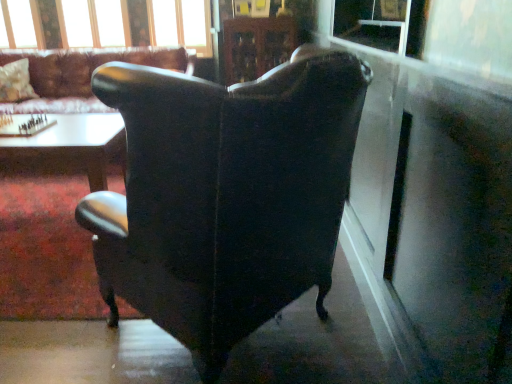
Question: Does clear glass window frame at upper center have a greater width compared to transparent plastic window screen at upper right?

Choices:
 (A) no
 (B) yes

Answer: (B)

Question: From a real-world perspective, is clear glass window frame at upper center on top of transparent plastic window screen at upper right?

Choices:
 (A) yes
 (B) no

Answer: (B)

Question: Considering the relative positions of clear glass window frame at upper center and transparent plastic window screen at upper right in the image provided, is clear glass window frame at upper center in front of transparent plastic window screen at upper right?

Choices:
 (A) yes
 (B) no

Answer: (B)

Question: Is clear glass window frame at upper center at the right side of transparent plastic window screen at upper right?

Choices:
 (A) no
 (B) yes

Answer: (A)

Question: Considering the relative sizes of clear glass window frame at upper center and transparent plastic window screen at upper right in the image provided, is clear glass window frame at upper center thinner than transparent plastic window screen at upper right?

Choices:
 (A) no
 (B) yes

Answer: (A)

Question: In the image, is white glossy table at lower left, placed as the second table when sorted from top to bottom, on the left side or the right side of wooden glossy table at center, which is the 1th table from top to bottom?

Choices:
 (A) left
 (B) right

Answer: (B)

Question: Is white glossy table at lower left, which is the 1th table from bottom to top, in front of or behind wooden glossy table at center, which is the second table from bottom to top, in the image?

Choices:
 (A) behind
 (B) front

Answer: (B)

Question: Considering the positions of white glossy table at lower left, which is the 1th table from bottom to top, and wooden glossy table at center, which is the second table from bottom to top, in the image, is white glossy table at lower left, which is the 1th table from bottom to top, bigger or smaller than wooden glossy table at center, which is the second table from bottom to top,?

Choices:
 (A) big
 (B) small

Answer: (B)

Question: Is white glossy table at lower left, which is the 1th table from bottom to top, taller or shorter than wooden glossy table at center, which is the 1th table from top to bottom?

Choices:
 (A) tall
 (B) short

Answer: (B)

Question: Is clear glass window frame at upper center situated inside white glossy table at lower left, placed as the second table when sorted from top to bottom, or outside?

Choices:
 (A) inside
 (B) outside

Answer: (B)

Question: Is point (200, 1) closer or farther from the camera than point (69, 274)?

Choices:
 (A) closer
 (B) farther

Answer: (B)

Question: Is clear glass window frame at upper center taller or shorter than white glossy table at lower left, which is the 1th table from bottom to top?

Choices:
 (A) tall
 (B) short

Answer: (A)

Question: Considering the positions of clear glass window frame at upper center and white glossy table at lower left, placed as the second table when sorted from top to bottom, in the image, is clear glass window frame at upper center wider or thinner than white glossy table at lower left, placed as the second table when sorted from top to bottom,?

Choices:
 (A) thin
 (B) wide

Answer: (A)

Question: Visually, is white glossy table at lower left, placed as the second table when sorted from top to bottom, positioned to the left or to the right of fluffy white pillow at upper left?

Choices:
 (A) left
 (B) right

Answer: (B)

Question: Considering the positions of white glossy table at lower left, which is the 1th table from bottom to top, and fluffy white pillow at upper left in the image, is white glossy table at lower left, which is the 1th table from bottom to top, taller or shorter than fluffy white pillow at upper left?

Choices:
 (A) tall
 (B) short

Answer: (B)